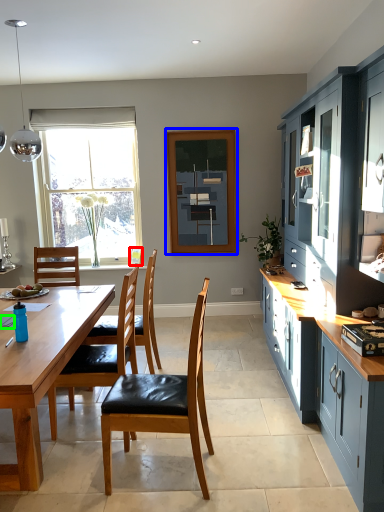
Question: Estimate the real-world distances between objects in this image. Which object is farther from picture frame (highlighted by a red box), window screen (highlighted by a blue box) or power plugs and sockets (highlighted by a green box)?

Choices:
 (A) window screen
 (B) power plugs and sockets

Answer: (B)